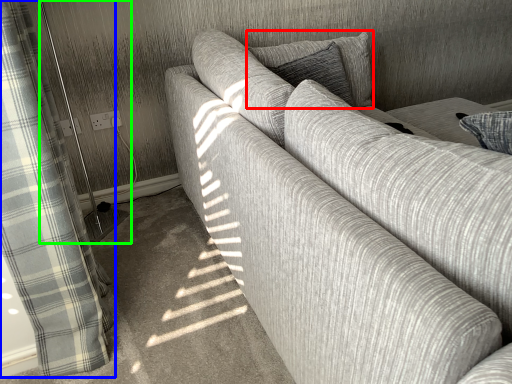
Question: Based on their relative distances, which object is farther from pillow (highlighted by a red box)? Choose from curtain (highlighted by a blue box) and screen door (highlighted by a green box).

Choices:
 (A) curtain
 (B) screen door

Answer: (B)